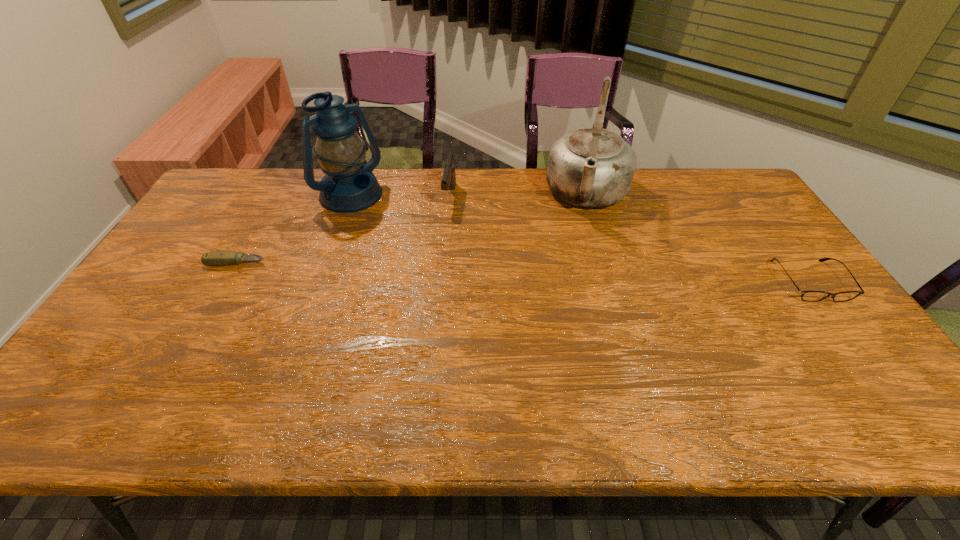
Where is `pistol at the far edge`? pistol at the far edge is located at coordinates coord(448,182).

Identify the location of lantern that is at the far edge. (349, 185).

Where is `object that is at the left edge`? The image size is (960, 540). object that is at the left edge is located at coordinates (218, 258).

This screenshot has width=960, height=540. I want to click on object that is at the right edge, so click(810, 296).

Locate an element on the screen. blank space at the far edge of the desktop is located at coordinates (685, 192).

At what (x,y) coordinates should I click in order to perform the action: click on vacant space at the near edge. Please return your answer as a coordinate pair (x, y). Looking at the image, I should click on (244, 359).

In the image, there is a desktop. What are the coordinates of `free region at the left edge` in the screenshot? It's located at (186, 228).

The height and width of the screenshot is (540, 960). In the image, there is a desktop. Identify the location of vacant space at the right edge. (732, 212).

Where is `vacant space at the far left corner of the desktop`? Image resolution: width=960 pixels, height=540 pixels. vacant space at the far left corner of the desktop is located at coordinates [x=258, y=175].

You are a GUI agent. You are given a task and a screenshot of the screen. Output one action in this format:
    pyautogui.click(x=<x>, y=<y>)
    Task: Click on the vacant area at the near right corner of the desktop
    This screenshot has height=540, width=960.
    Given the screenshot: What is the action you would take?
    pyautogui.click(x=836, y=375)